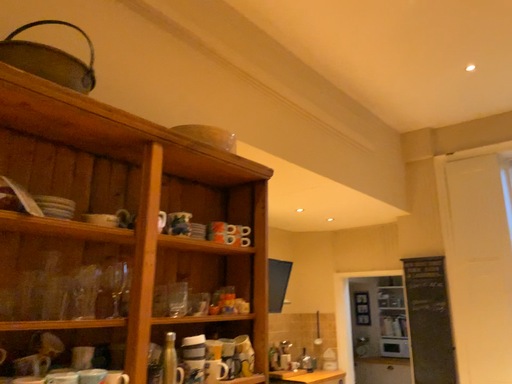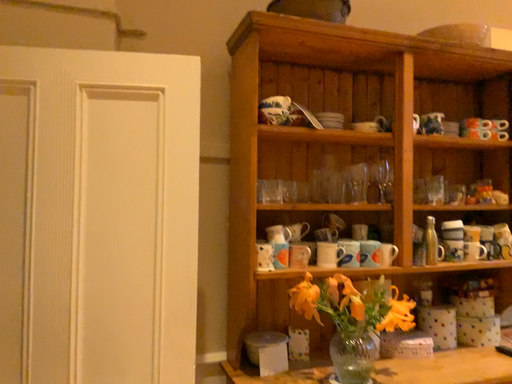
Question: How did the camera likely rotate when shooting the video?

Choices:
 (A) rotated upward
 (B) rotated downward

Answer: (B)